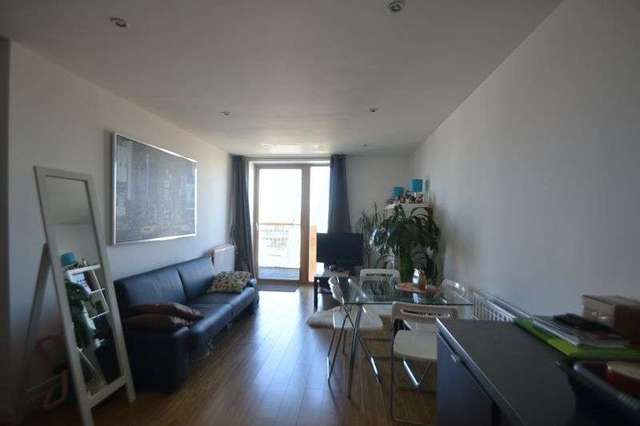
Identify the location of painting. (170, 192).